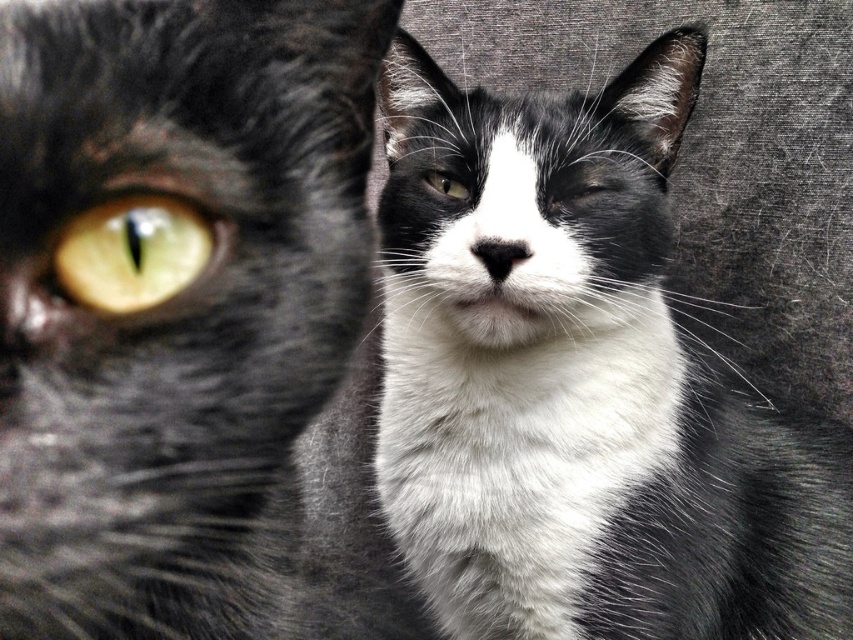
Between black and white fur cat at center and matte black eye at center, which one has more height?

With more height is black and white fur cat at center.

Is point (756, 620) more distant than point (573, 182)?

Yes, point (756, 620) is behind point (573, 182).

Where is `black and white fur cat at center`? This screenshot has height=640, width=853. black and white fur cat at center is located at coordinates (579, 385).

Can you confirm if black and white fur cat at center is taller than yellow-green eye at left?

Indeed, black and white fur cat at center has a greater height compared to yellow-green eye at left.

Which of these two, black and white fur cat at center or yellow-green eye at left, stands shorter?

Standing shorter between the two is yellow-green eye at left.

Image resolution: width=853 pixels, height=640 pixels. In order to click on black and white fur cat at center in this screenshot , I will do `click(579, 385)`.

Does point (22, 381) come closer to viewer compared to point (434, 173)?

Yes, point (22, 381) is closer to viewer.

Which is behind, point (231, 561) or point (447, 186)?

Positioned behind is point (447, 186).

Who is more forward, (149, 385) or (427, 172)?

Point (149, 385) is in front.

Identify the location of shiny black fur at left. (172, 298).